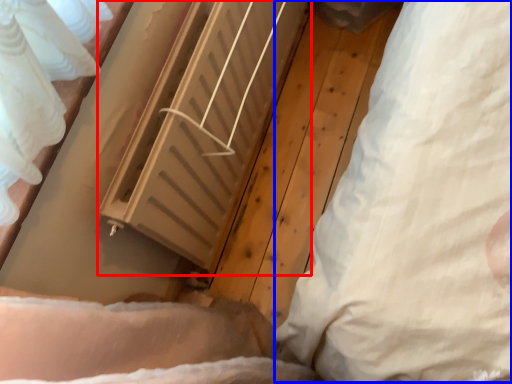
Question: Which of the following is the farthest to the observer, radiator (highlighted by a red box) or pillow (highlighted by a blue box)?

Choices:
 (A) radiator
 (B) pillow

Answer: (A)